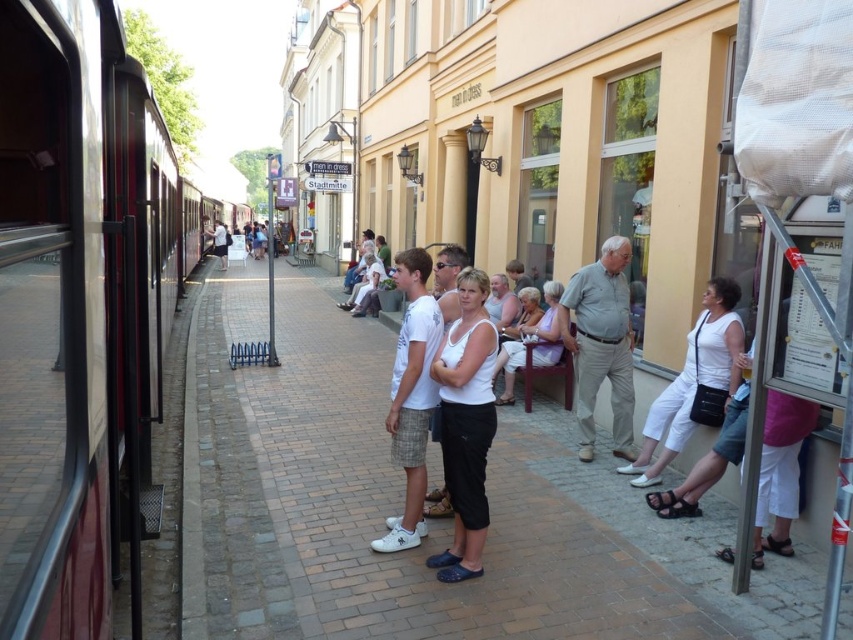
Can you confirm if brick pavement at center is taller than gray cotton shirt at center?

No.

In order to click on brick pavement at center in this screenshot , I will do point(430,520).

Describe the element at coordinates (430, 520) in the screenshot. I see `brick pavement at center` at that location.

Image resolution: width=853 pixels, height=640 pixels. I want to click on brick pavement at center, so [430, 520].

Is gray cotton shirt at center smaller than white cotton shirt at center?

Yes.

Locate an element on the screen. gray cotton shirt at center is located at coordinates (601, 342).

Is point (618, 410) positioned before point (222, 224)?

Yes.

Identify the location of gray cotton shirt at center. The image size is (853, 640). (601, 342).

Can you confirm if brick pavement at center is thinner than white matte shorts at center?

Incorrect, brick pavement at center's width is not less than white matte shorts at center's.

Does brick pavement at center have a greater height compared to white matte shorts at center?

No, brick pavement at center is not taller than white matte shorts at center.

What do you see at coordinates (430, 520) in the screenshot? I see `brick pavement at center` at bounding box center [430, 520].

Where is `brick pavement at center`? Image resolution: width=853 pixels, height=640 pixels. brick pavement at center is located at coordinates (430, 520).